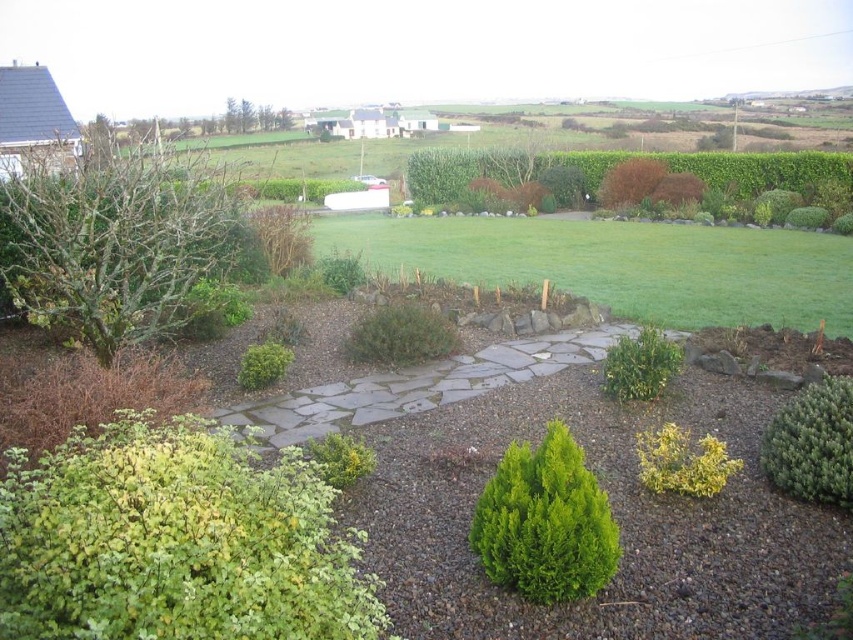
Question: Which point is farther to the camera?

Choices:
 (A) click(210, 257)
 (B) click(264, 433)

Answer: (A)

Question: Does gray stone path at center appear on the left side of green textured shrub at lower right?

Choices:
 (A) yes
 (B) no

Answer: (A)

Question: Which object is closer to the camera taking this photo?

Choices:
 (A) bare branches at left
 (B) green textured shrub at lower right
 (C) green leafy shrub at center-right

Answer: (B)

Question: Considering the real-world distances, which object is farthest from the green leafy shrub at center-right?

Choices:
 (A) gray stone path at center
 (B) green textured shrub at lower right
 (C) bare branches at left

Answer: (C)

Question: Does bare branches at left appear over gray stone path at center?

Choices:
 (A) yes
 (B) no

Answer: (A)

Question: Can you confirm if green textured shrub at lower right is positioned to the left of green leafy shrub at center-right?

Choices:
 (A) no
 (B) yes

Answer: (A)